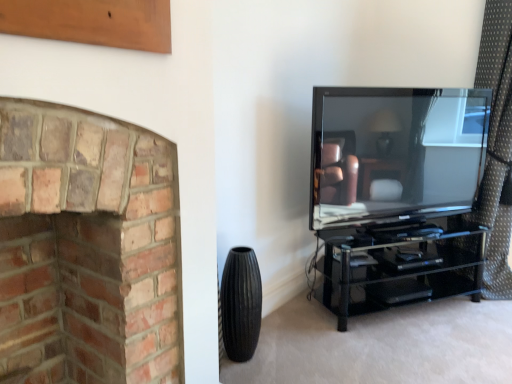
Question: Considering the relative positions of matte black tv at right and red brick fireplace at left in the image provided, is matte black tv at right behind red brick fireplace at left?

Choices:
 (A) yes
 (B) no

Answer: (A)

Question: Does matte black tv at right turn towards red brick fireplace at left?

Choices:
 (A) no
 (B) yes

Answer: (A)

Question: Can you confirm if matte black tv at right is smaller than red brick fireplace at left?

Choices:
 (A) yes
 (B) no

Answer: (A)

Question: From a real-world perspective, is matte black tv at right positioned over red brick fireplace at left based on gravity?

Choices:
 (A) no
 (B) yes

Answer: (B)

Question: Is matte black tv at right taller than red brick fireplace at left?

Choices:
 (A) yes
 (B) no

Answer: (B)

Question: Is point (75, 299) positioned closer to the camera than point (358, 145)?

Choices:
 (A) farther
 (B) closer

Answer: (B)

Question: Based on their positions, is red brick fireplace at left located to the left or right of matte black tv at right?

Choices:
 (A) left
 (B) right

Answer: (A)

Question: From a real-world perspective, is red brick fireplace at left positioned above or below matte black tv at right?

Choices:
 (A) below
 (B) above

Answer: (A)

Question: Is red brick fireplace at left in front of or behind matte black tv at right in the image?

Choices:
 (A) behind
 (B) front

Answer: (B)

Question: Is black ribbed vase at lower center taller or shorter than red brick fireplace at left?

Choices:
 (A) short
 (B) tall

Answer: (A)

Question: Is black ribbed vase at lower center wider or thinner than red brick fireplace at left?

Choices:
 (A) wide
 (B) thin

Answer: (B)

Question: Relative to red brick fireplace at left, is black ribbed vase at lower center in front or behind?

Choices:
 (A) front
 (B) behind

Answer: (B)

Question: From a real-world perspective, is black ribbed vase at lower center positioned above or below red brick fireplace at left?

Choices:
 (A) above
 (B) below

Answer: (B)

Question: Would you say matte black tv at right is to the left or to the right of brown dotted fabric at right in the picture?

Choices:
 (A) left
 (B) right

Answer: (A)

Question: Would you say matte black tv at right is inside or outside brown dotted fabric at right?

Choices:
 (A) outside
 (B) inside

Answer: (A)